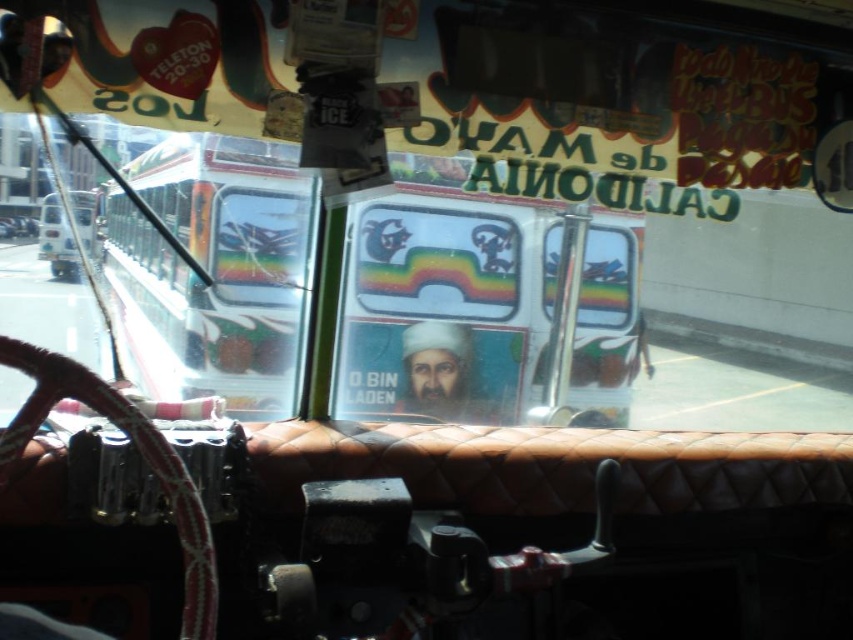
Question: Which object appears farthest from the camera in this image?

Choices:
 (A) metallic silver car at center
 (B) matte plastic poster at center
 (C) metallic silver bus at left

Answer: (B)

Question: Which of the following is the farthest from the observer?

Choices:
 (A) [289, 227]
 (B) [45, 252]
 (C) [438, 413]

Answer: (C)

Question: Is metallic silver bus at left bigger than matte plastic poster at center?

Choices:
 (A) no
 (B) yes

Answer: (B)

Question: Is matte plastic poster at center further to the viewer compared to white glossy bus at left?

Choices:
 (A) yes
 (B) no

Answer: (A)

Question: Where is matte plastic poster at center located in relation to metallic silver car at center in the image?

Choices:
 (A) below
 (B) above

Answer: (A)

Question: Among these objects, which one is farthest from the camera?

Choices:
 (A) metallic silver car at center
 (B) matte plastic poster at center

Answer: (B)